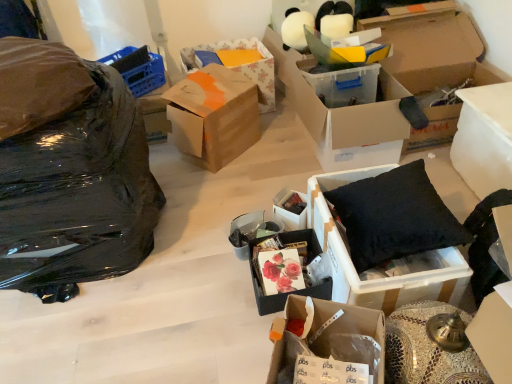
This screenshot has height=384, width=512. In order to click on vacant area to the left of matte floral print box at center, acting as the seventh box starting from the right in this screenshot , I will do `click(219, 290)`.